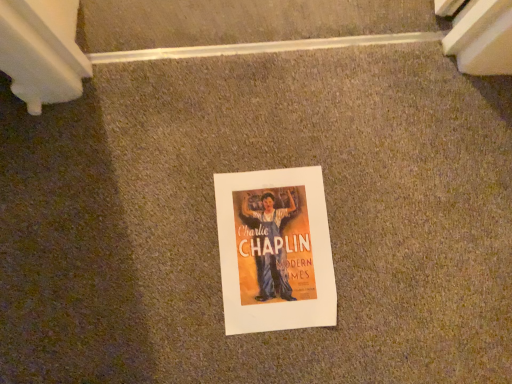
In order to click on white paper poster at center in this screenshot , I will do `click(275, 250)`.

The image size is (512, 384). What do you see at coordinates (275, 250) in the screenshot?
I see `white paper poster at center` at bounding box center [275, 250].

Measure the distance between point (238, 250) and camera.

They are 79.40 centimeters apart.

Find the location of a particular element. This screenshot has width=512, height=384. white paper poster at center is located at coordinates (275, 250).